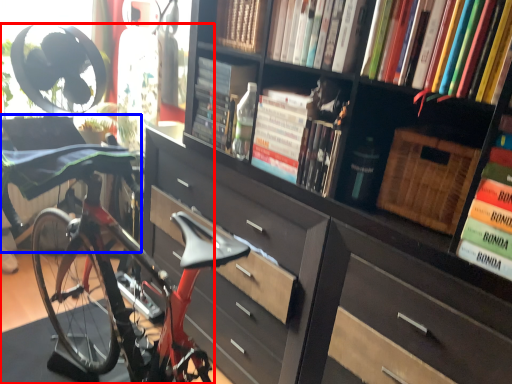
Question: Among these objects, which one is farthest to the camera, bicycle (highlighted by a red box) or swivel chair (highlighted by a blue box)?

Choices:
 (A) bicycle
 (B) swivel chair

Answer: (A)